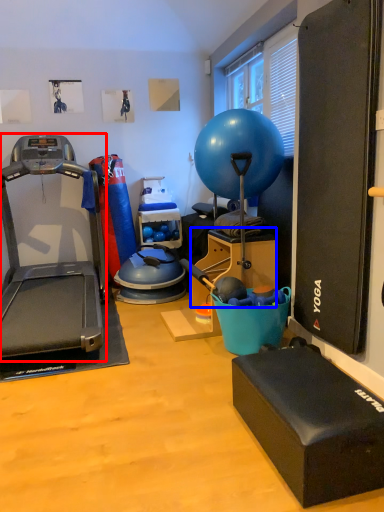
Question: Among these objects, which one is nearest to the camera, treadmill (highlighted by a red box) or box (highlighted by a blue box)?

Choices:
 (A) treadmill
 (B) box

Answer: (A)